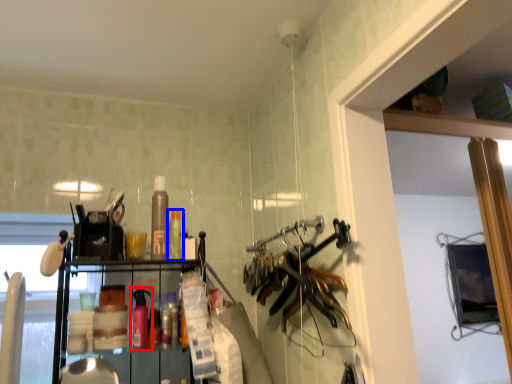
Question: Which point is closer to the camera, bottle (highlighted by a red box) or bottle (highlighted by a blue box)?

Choices:
 (A) bottle
 (B) bottle

Answer: (A)